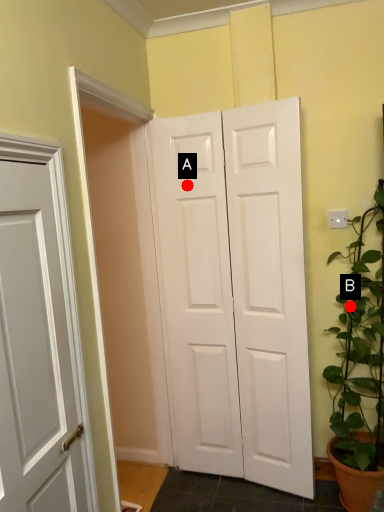
Question: Two points are circled on the image, labeled by A and B beside each circle. Which point is farther to the camera?

Choices:
 (A) A is further
 (B) B is further

Answer: (A)